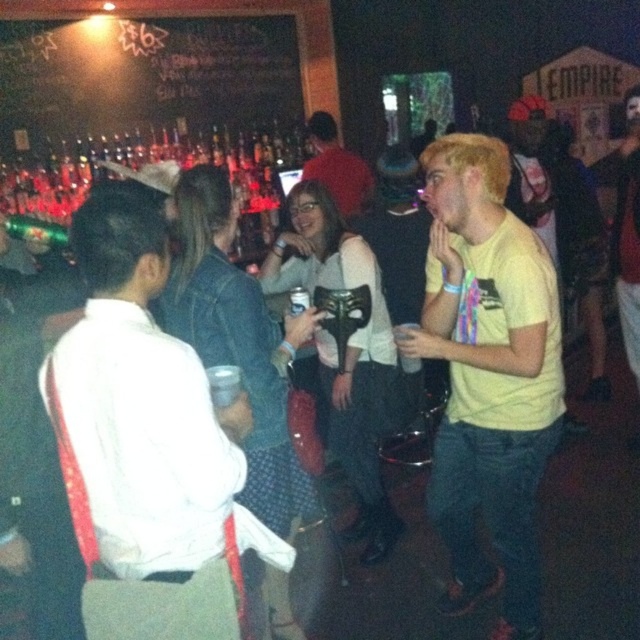
Does point (42, 596) come in front of point (324, 125)?

Yes.

Between white fabric shirt at left and matte red shirt at center, which one appears on the left side from the viewer's perspective?

white fabric shirt at left

At what (x,y) coordinates should I click in order to perform the action: click on white fabric shirt at left. Please return your answer as a coordinate pair (x, y). This screenshot has height=640, width=640. Looking at the image, I should click on (35, 449).

At what (x,y) coordinates should I click in order to perform the action: click on white fabric shirt at left. Please return your answer as a coordinate pair (x, y). Image resolution: width=640 pixels, height=640 pixels. Looking at the image, I should click on (35, 449).

Which is below, yellow matte t-shirt at center or white fabric shirt at left?

Positioned lower is yellow matte t-shirt at center.

You are a GUI agent. You are given a task and a screenshot of the screen. Output one action in this format:
    pyautogui.click(x=<x>, y=<y>)
    Task: Click on the yellow matte t-shirt at center
    This screenshot has height=640, width=640.
    Given the screenshot: What is the action you would take?
    pyautogui.click(x=486, y=374)

Is white matte shirt at left to the right of matte red shirt at center from the viewer's perspective?

No, white matte shirt at left is not to the right of matte red shirt at center.

I want to click on white matte shirt at left, so click(x=147, y=445).